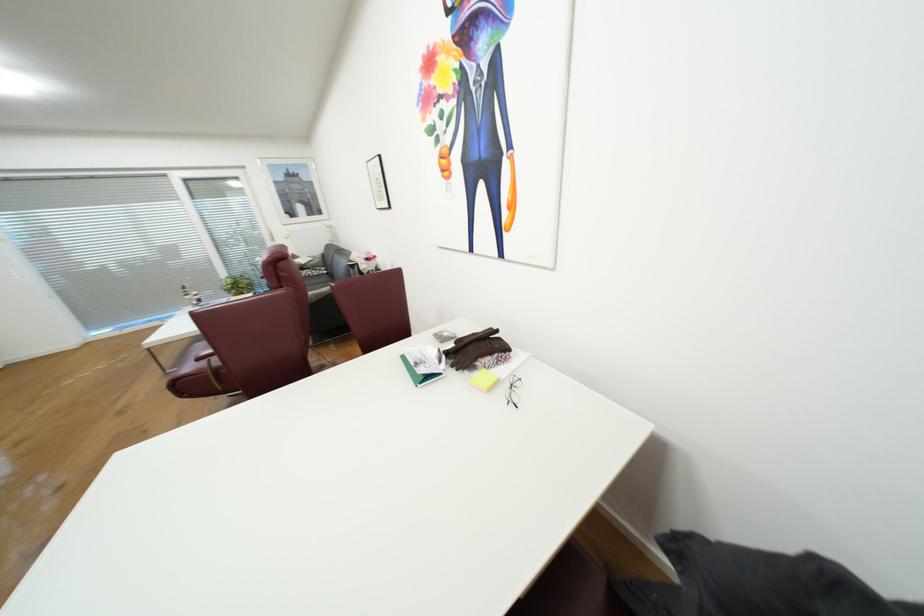
Where would you rest the sofa armrest? Please return your answer as a coordinate pair (x, y).

(319, 294)